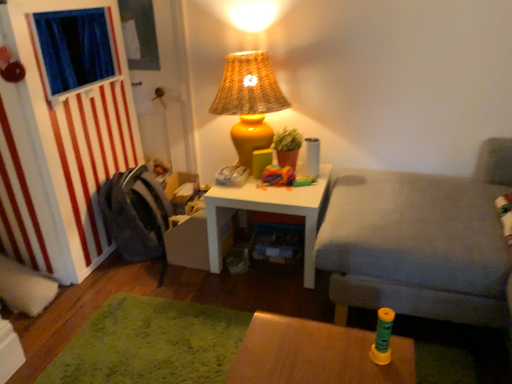
Question: From a real-world perspective, is white matte table at center, placed as the 2th table when sorted from front to back, over gray fabric couch at right?

Choices:
 (A) no
 (B) yes

Answer: (A)

Question: Considering the relative sizes of white matte table at center, which ranks as the second table in bottom-to-top order, and gray fabric couch at right in the image provided, is white matte table at center, which ranks as the second table in bottom-to-top order, thinner than gray fabric couch at right?

Choices:
 (A) no
 (B) yes

Answer: (B)

Question: Is white matte table at center, placed as the 2th table when sorted from front to back, to the right of gray fabric couch at right from the viewer's perspective?

Choices:
 (A) no
 (B) yes

Answer: (A)

Question: Is white matte table at center, placed as the 2th table when sorted from front to back, positioned before gray fabric couch at right?

Choices:
 (A) yes
 (B) no

Answer: (B)

Question: Is white matte table at center, placed as the 2th table when sorted from front to back, not inside gray fabric couch at right?

Choices:
 (A) no
 (B) yes

Answer: (B)

Question: In the image, is white matte table at center, which ranks as the 1th table in top-to-bottom order, on the left side or the right side of blue fabric curtain at left?

Choices:
 (A) left
 (B) right

Answer: (B)

Question: Relative to blue fabric curtain at left, is white matte table at center, which ranks as the second table in bottom-to-top order, in front or behind?

Choices:
 (A) behind
 (B) front

Answer: (A)

Question: Considering the positions of point click(x=269, y=210) and point click(x=53, y=92), is point click(x=269, y=210) closer or farther from the camera than point click(x=53, y=92)?

Choices:
 (A) closer
 (B) farther

Answer: (B)

Question: Do you think white matte table at center, placed as the 2th table when sorted from front to back, is within blue fabric curtain at left, or outside of it?

Choices:
 (A) outside
 (B) inside

Answer: (A)

Question: Considering the relative positions of gray fabric couch at right and wooden table at lower center, the 2th table in the back-to-front sequence, in the image provided, is gray fabric couch at right to the left or to the right of wooden table at lower center, the 2th table in the back-to-front sequence,?

Choices:
 (A) right
 (B) left

Answer: (A)

Question: From the image's perspective, is gray fabric couch at right positioned above or below wooden table at lower center, marked as the first table in a bottom-to-top arrangement?

Choices:
 (A) above
 (B) below

Answer: (A)

Question: Does point (508, 254) appear closer or farther from the camera than point (347, 359)?

Choices:
 (A) closer
 (B) farther

Answer: (B)

Question: In terms of width, does gray fabric couch at right look wider or thinner when compared to wooden table at lower center, the first table when ordered from front to back?

Choices:
 (A) wide
 (B) thin

Answer: (A)

Question: Is point (245, 200) closer or farther from the camera than point (378, 198)?

Choices:
 (A) closer
 (B) farther

Answer: (B)

Question: From a real-world perspective, is white matte table at center, which is the 1th table in back-to-front order, above or below gray fabric couch at right?

Choices:
 (A) above
 (B) below

Answer: (B)